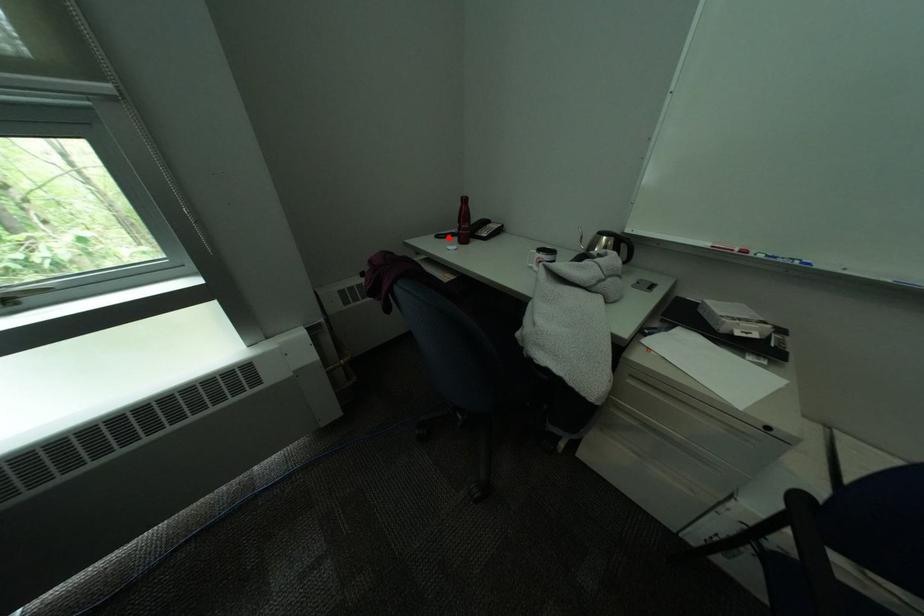
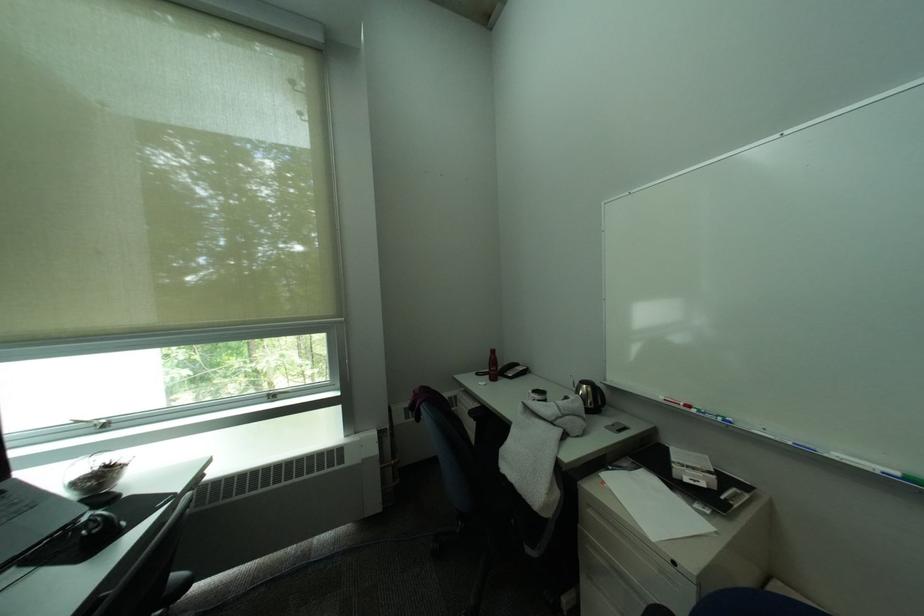
Question: A red point is marked in image1. In image2, is the corresponding 3D point closer to the camera or farther? Reply with the corresponding letter.

Choices:
 (A) The corresponding 3D point is closer.
 (B) The corresponding 3D point is farther.

Answer: (B)